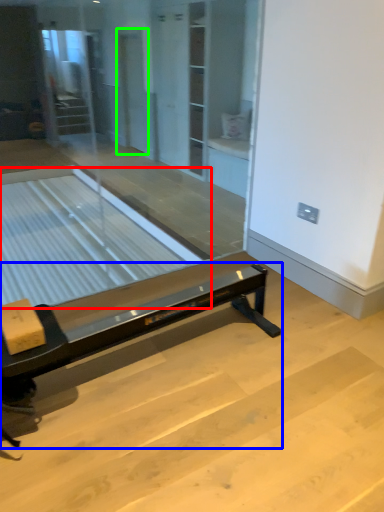
Question: Estimate the real-world distances between objects in this image. Which object is farther from table (highlighted by a red box), furniture (highlighted by a blue box) or screen door (highlighted by a green box)?

Choices:
 (A) furniture
 (B) screen door

Answer: (A)